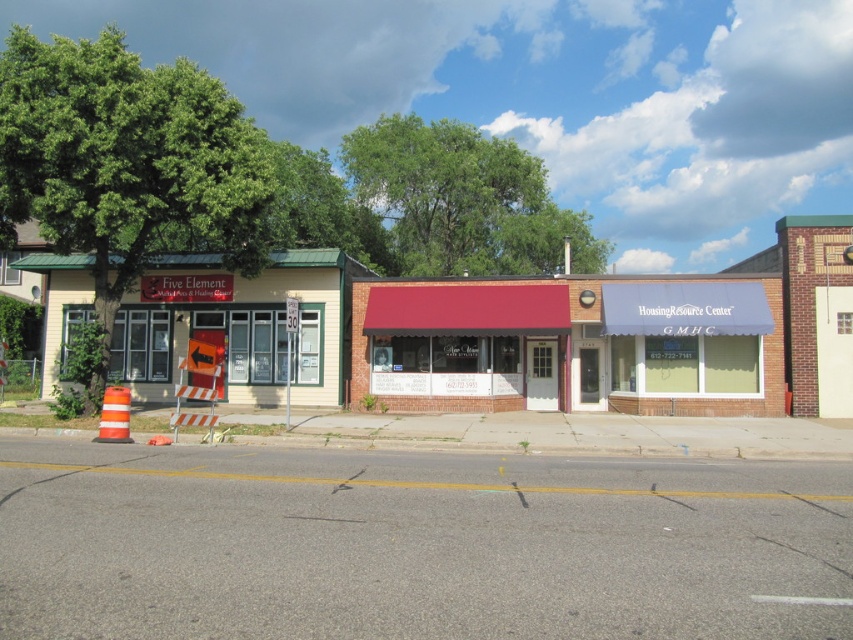
Can you confirm if maroon fabric awning at center is positioned to the left of yellow siding at left?

In fact, maroon fabric awning at center is to the right of yellow siding at left.

Is maroon fabric awning at center behind yellow siding at left?

Yes, it is.

Identify the location of maroon fabric awning at center. The height and width of the screenshot is (640, 853). (572, 344).

Locate an element on the screen. The image size is (853, 640). maroon fabric awning at center is located at coordinates (572, 344).